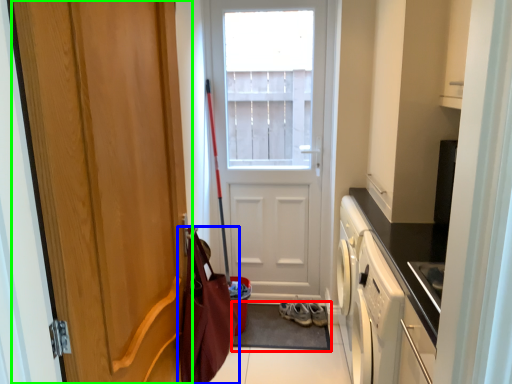
Question: Estimate the real-world distances between objects in this image. Which object is closer to doormat (highlighted by a red box), messenger bag (highlighted by a blue box) or door (highlighted by a green box)?

Choices:
 (A) messenger bag
 (B) door

Answer: (A)